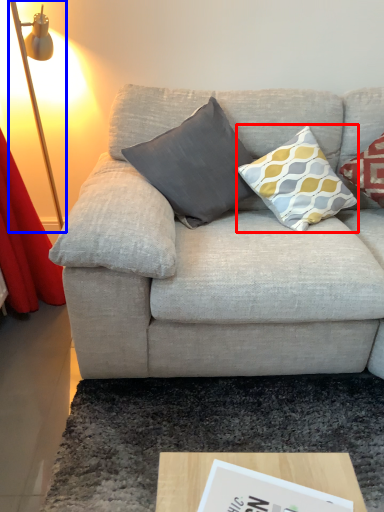
Question: Which object appears closest to the camera in this image, pillow (highlighted by a red box) or table lamp (highlighted by a blue box)?

Choices:
 (A) pillow
 (B) table lamp

Answer: (B)